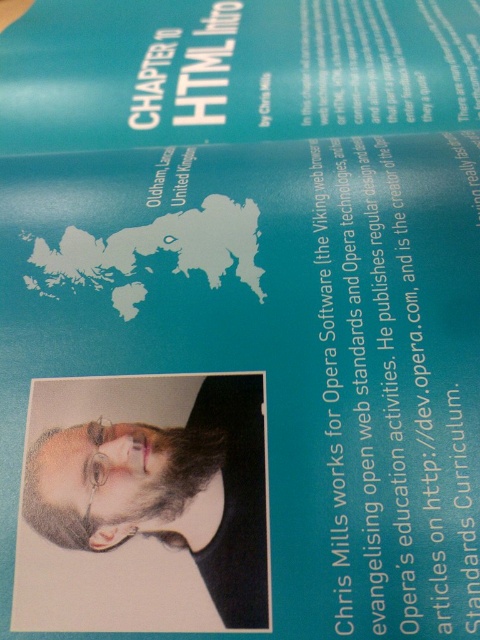
You are designing a poster and need to place the teal matte paper at upper center and the beige paper portrait at center. According to the slide layout, which object should be placed to the right of the other?

The teal matte paper at upper center should be placed to the right of the beige paper portrait at center, as the teal matte paper at upper center is positioned on the right side of beige paper portrait at center.

You are a student who needs to write a note on the teal matte paper at upper center. Your pencil is currently on the desk 1.00 meters away from the paper. Can you reach it without moving your chair?

The pencil is 1.00 meters away from the teal matte paper at upper center, so you can reach it without moving your chair if your arm can extend that far, but typically, 1 meter might be a bit too far for most people to reach comfortably.